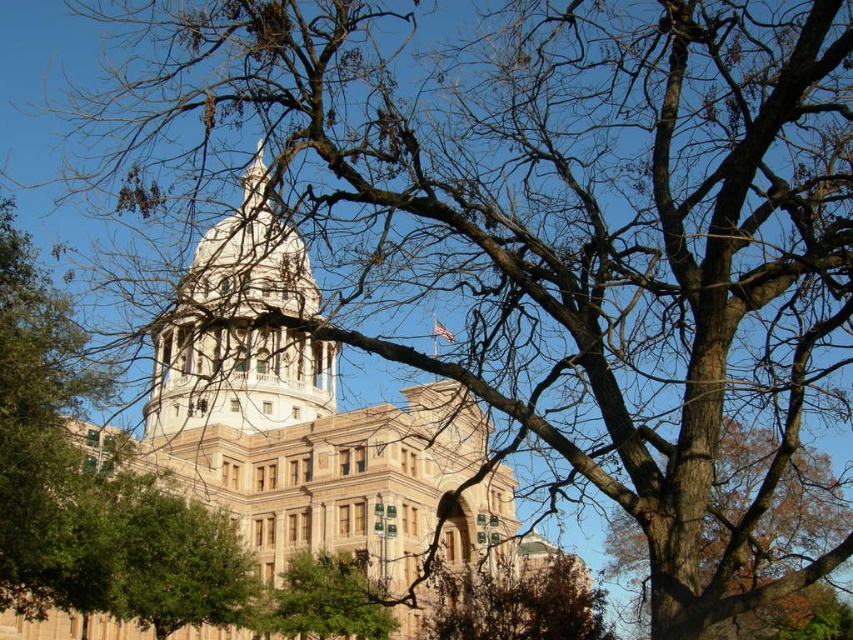
Question: Does light brown stone bell tower at center have a smaller size compared to brown rough bark tree at center right?

Choices:
 (A) no
 (B) yes

Answer: (B)

Question: Can you confirm if light brown stone bell tower at center is positioned to the left of brown rough bark tree at center right?

Choices:
 (A) yes
 (B) no

Answer: (A)

Question: Does beige stone tower at center have a lesser width compared to light brown stone bell tower at center?

Choices:
 (A) yes
 (B) no

Answer: (B)

Question: Estimate the real-world distances between objects in this image. Which object is farther from the beige stone tower at center?

Choices:
 (A) light brown stone bell tower at center
 (B) green leafy tree at center

Answer: (B)

Question: Which point is farther to the camera?

Choices:
 (A) green leafy tree at center
 (B) brown rough bark tree at center right
 (C) light brown stone bell tower at center

Answer: (A)

Question: Which point is closer to the camera?

Choices:
 (A) (445, 580)
 (B) (311, 592)

Answer: (B)